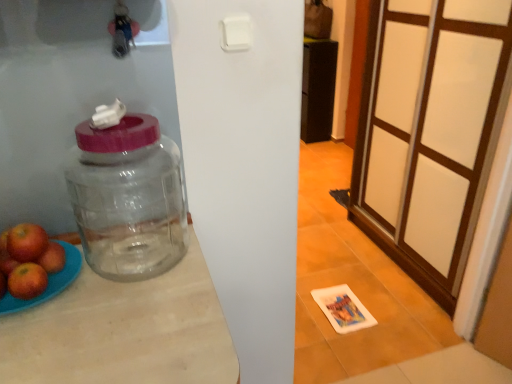
Question: Considering the relative positions of red matte apple at left, which is counted as the second apple, starting from the right, and transparent glass jar at left in the image provided, is red matte apple at left, which is counted as the second apple, starting from the right, to the left or to the right of transparent glass jar at left?

Choices:
 (A) left
 (B) right

Answer: (A)

Question: Looking at their shapes, would you say red matte apple at left, which appears as the second apple when viewed from the left, is wider or thinner than transparent glass jar at left?

Choices:
 (A) thin
 (B) wide

Answer: (A)

Question: Estimate the real-world distances between objects in this image. Which object is closer to the transparent glass jar at left?

Choices:
 (A) clear wood table at center
 (B) red matte apple at left, marked as the third apple in a right-to-left arrangement
 (C) white frosted glass screen door at right
 (D) red matte apple at left, placed as the first apple when sorted from right to left
 (E) red matte apple at left, which appears as the second apple when viewed from the left

Answer: (A)

Question: Based on their relative distances, which object is farther from the clear wood table at center?

Choices:
 (A) red matte apple at left, which is counted as the second apple, starting from the right
 (B) red matte apple at left, marked as the third apple in a right-to-left arrangement
 (C) red matte apple at left, placed as the first apple when sorted from right to left
 (D) transparent glass jar at left
 (E) white frosted glass screen door at right

Answer: (E)